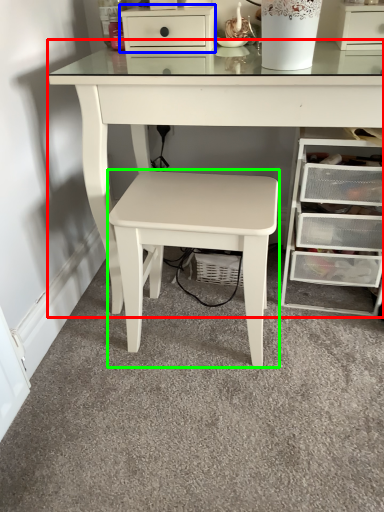
Question: Which object is positioned closest to table (highlighted by a red box)? Select from chest of drawers (highlighted by a blue box) and stool (highlighted by a green box).

Choices:
 (A) chest of drawers
 (B) stool

Answer: (B)